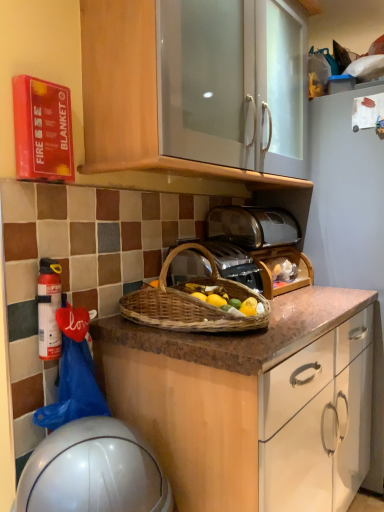
This screenshot has height=512, width=384. Describe the element at coordinates (49, 309) in the screenshot. I see `white matte fire extinguisher at left` at that location.

Image resolution: width=384 pixels, height=512 pixels. What do you see at coordinates (235, 264) in the screenshot?
I see `metallic silver toaster at center` at bounding box center [235, 264].

This screenshot has width=384, height=512. I want to click on satin silver toaster at center, so click(x=253, y=226).

Locate an element on the screen. Image resolution: width=384 pixels, height=512 pixels. white matte fire extinguisher at left is located at coordinates (49, 309).

Between white glossy helmet at lower left and white matte fire extinguisher at left, which one is positioned in front?

white glossy helmet at lower left is more forward.

Is there a large distance between white glossy helmet at lower left and white matte fire extinguisher at left?

No, white glossy helmet at lower left is not far away from white matte fire extinguisher at left.

Choose the correct answer: Is white glossy helmet at lower left inside white matte fire extinguisher at left or outside it?

white glossy helmet at lower left is not enclosed by white matte fire extinguisher at left.

Is white glossy helmet at lower left aimed at white matte fire extinguisher at left?

No, white glossy helmet at lower left is not turned towards white matte fire extinguisher at left.

Is white glossy helmet at lower left placed right next to satin silver toaster at center?

No, white glossy helmet at lower left is not next to satin silver toaster at center.

Is white glossy helmet at lower left thinner than satin silver toaster at center?

In fact, white glossy helmet at lower left might be wider than satin silver toaster at center.

From the image's perspective, which one is positioned higher, white glossy helmet at lower left or satin silver toaster at center?

satin silver toaster at center, from the image's perspective.

From a real-world perspective, is white glossy helmet at lower left located beneath satin silver toaster at center?

Yes.

Choose the correct answer: Is white glossy helmet at lower left inside woven brown picnic basket at center or outside it?

white glossy helmet at lower left is located beyond the bounds of woven brown picnic basket at center.

Does white glossy helmet at lower left have a greater height compared to woven brown picnic basket at center?

Yes.

From the image's perspective, is white glossy helmet at lower left on top of woven brown picnic basket at center?

Actually, white glossy helmet at lower left appears below woven brown picnic basket at center in the image.

How far apart are white matte fire extinguisher at left and woven brown picnic basket at center?

They are 13.42 inches apart.

Can you tell me how much white matte fire extinguisher at left and woven brown picnic basket at center differ in facing direction?

white matte fire extinguisher at left and woven brown picnic basket at center are facing 5.61 degrees away from each other.

At what (x,y) coordinates should I click in order to perform the action: click on bottle on the left of the woven brown picnic basket at center. Please return your answer as a coordinate pair (x, y). Image resolution: width=384 pixels, height=512 pixels. Looking at the image, I should click on (49, 309).

From a real-world perspective, is white matte fire extinguisher at left positioned under woven brown picnic basket at center based on gravity?

Indeed, from a real-world perspective, white matte fire extinguisher at left is positioned beneath woven brown picnic basket at center.

Is matte wood cabinet at upper center spatially inside metallic silver toaster at center, or outside of it?

matte wood cabinet at upper center is spatially situated outside metallic silver toaster at center.

Where is `gas stove below the matte wood cabinet at upper center (from a real-world perspective)`? The height and width of the screenshot is (512, 384). gas stove below the matte wood cabinet at upper center (from a real-world perspective) is located at coordinates (235, 264).

Between matte wood cabinet at upper center and metallic silver toaster at center, which one has smaller width?

metallic silver toaster at center is thinner.

Does point (209, 190) appear closer or farther from the camera than point (219, 263)?

Point (209, 190) is positioned farther from the camera compared to point (219, 263).

Considering the relative sizes of satin silver toaster at center and matte wood cabinet at upper center in the image provided, is satin silver toaster at center taller than matte wood cabinet at upper center?

No.

Could matte wood cabinet at upper center be considered to be inside satin silver toaster at center?

Definitely not — matte wood cabinet at upper center is not inside satin silver toaster at center.

Is satin silver toaster at center aimed at matte wood cabinet at upper center?

No, satin silver toaster at center is not aimed at matte wood cabinet at upper center.

Considering the relative positions of satin silver toaster at center and matte wood cabinet at upper center in the image provided, is satin silver toaster at center to the right of matte wood cabinet at upper center from the viewer's perspective?

Indeed, satin silver toaster at center is positioned on the right side of matte wood cabinet at upper center.

From the image's perspective, which one is positioned lower, white matte fire extinguisher at left or matte wood cabinet at upper center?

white matte fire extinguisher at left appears lower in the image.

Who is taller, white matte fire extinguisher at left or matte wood cabinet at upper center?

matte wood cabinet at upper center is taller.

Is white matte fire extinguisher at left situated inside matte wood cabinet at upper center or outside?

The correct answer is: outside.

Does point (53, 321) lie in front of point (86, 59)?

Yes, point (53, 321) is in front of point (86, 59).

The height and width of the screenshot is (512, 384). Find the location of `appliance on the right of the white matte fire extinguisher at left`. appliance on the right of the white matte fire extinguisher at left is located at coordinates point(93,471).

The width and height of the screenshot is (384, 512). What are the coordinates of `appliance that is on the left side of satin silver toaster at center` in the screenshot? It's located at (93, 471).

Considering their positions, is matte wood cabinet at upper center positioned closer to white matte fire extinguisher at left than woven brown picnic basket at center?

woven brown picnic basket at center is closer to white matte fire extinguisher at left.

Looking at the image, which one is located closer to white glossy helmet at lower left, satin silver toaster at center or metallic silver toaster at center?

Based on the image, metallic silver toaster at center appears to be nearer to white glossy helmet at lower left.

Looking at the image, which one is located further to satin silver toaster at center, white matte fire extinguisher at left or matte wood cabinet at upper center?

white matte fire extinguisher at left.

Estimate the real-world distances between objects in this image. Which object is closer to matte wood cabinet at upper center, metallic silver toaster at center or white glossy helmet at lower left?

metallic silver toaster at center.

From the image, which object appears to be nearer to white matte fire extinguisher at left, metallic silver toaster at center or white glossy helmet at lower left?

Based on the image, white glossy helmet at lower left appears to be nearer to white matte fire extinguisher at left.

From the image, which object appears to be farther from white matte fire extinguisher at left, white glossy helmet at lower left or woven brown picnic basket at center?

Among the two, woven brown picnic basket at center is located further to white matte fire extinguisher at left.

Which object lies further to the anchor point satin silver toaster at center, metallic silver toaster at center or matte wood cabinet at upper center?

Among the two, matte wood cabinet at upper center is located further to satin silver toaster at center.

From the image, which object appears to be farther from white matte fire extinguisher at left, woven brown picnic basket at center or matte wood cabinet at upper center?

matte wood cabinet at upper center.

Locate an element on the screen. This screenshot has height=512, width=384. gas stove located between white matte fire extinguisher at left and satin silver toaster at center in the left-right direction is located at coordinates (235, 264).

This screenshot has width=384, height=512. Find the location of `toaster between matte wood cabinet at upper center and metallic silver toaster at center from top to bottom`. toaster between matte wood cabinet at upper center and metallic silver toaster at center from top to bottom is located at coordinates (253, 226).

Locate an element on the screen. picnic basket between white glossy helmet at lower left and metallic silver toaster at center from front to back is located at coordinates (191, 303).

You are a GUI agent. You are given a task and a screenshot of the screen. Output one action in this format:
    pyautogui.click(x=<x>, y=<y>)
    Task: Click on the gas stove between matte wood cabinet at upper center and woven brown picnic basket at center vertically
    The height and width of the screenshot is (512, 384).
    Given the screenshot: What is the action you would take?
    pyautogui.click(x=235, y=264)